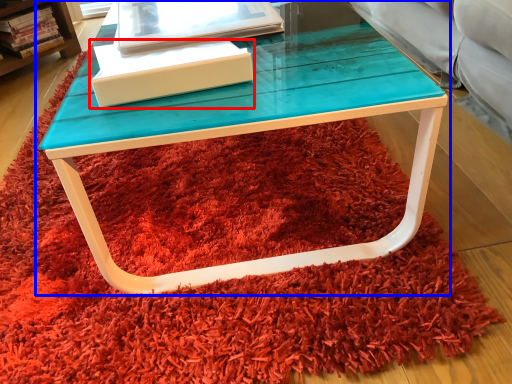
Question: Which of the following is the closest to the observer, box (highlighted by a red box) or table (highlighted by a blue box)?

Choices:
 (A) box
 (B) table

Answer: (B)